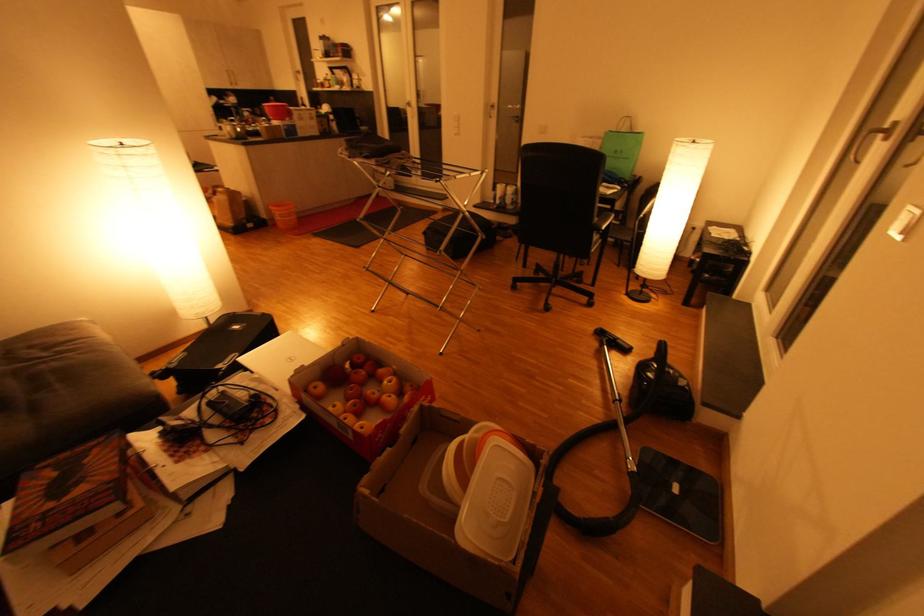
Where would you lift the white plastic lid? Please return your answer as a coordinate pair (x, y).

(495, 503)